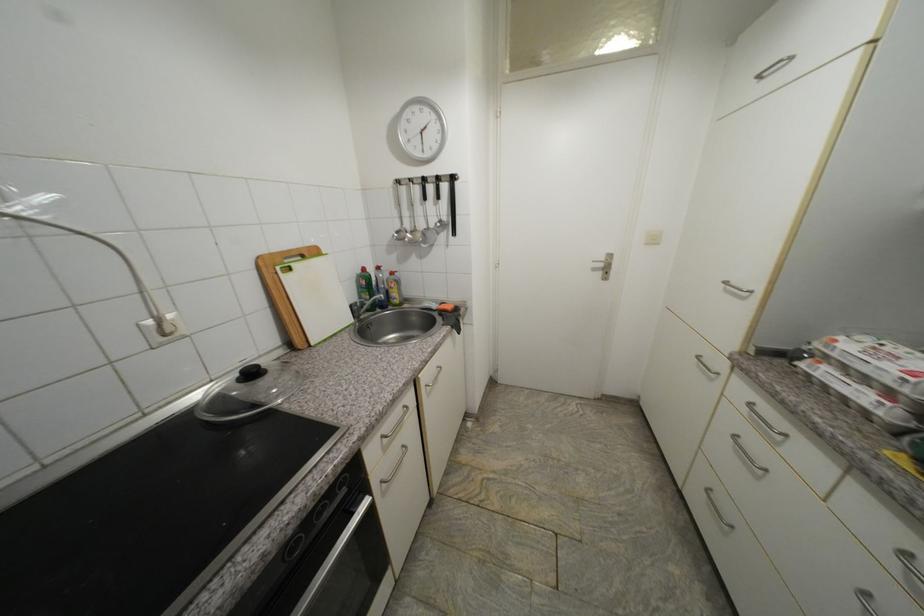
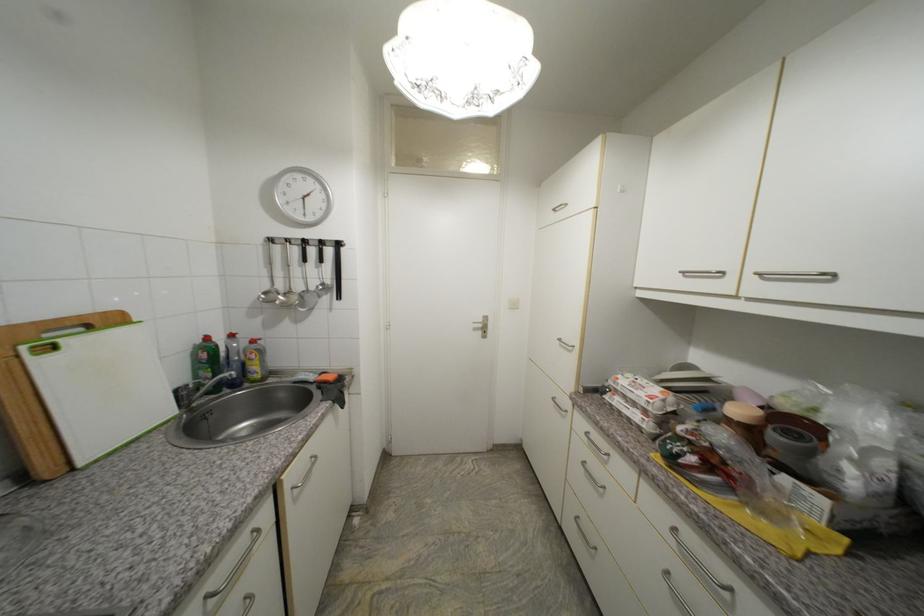
Where in the second image is the point corresponding to the point at 428,227 from the first image?

(305, 289)